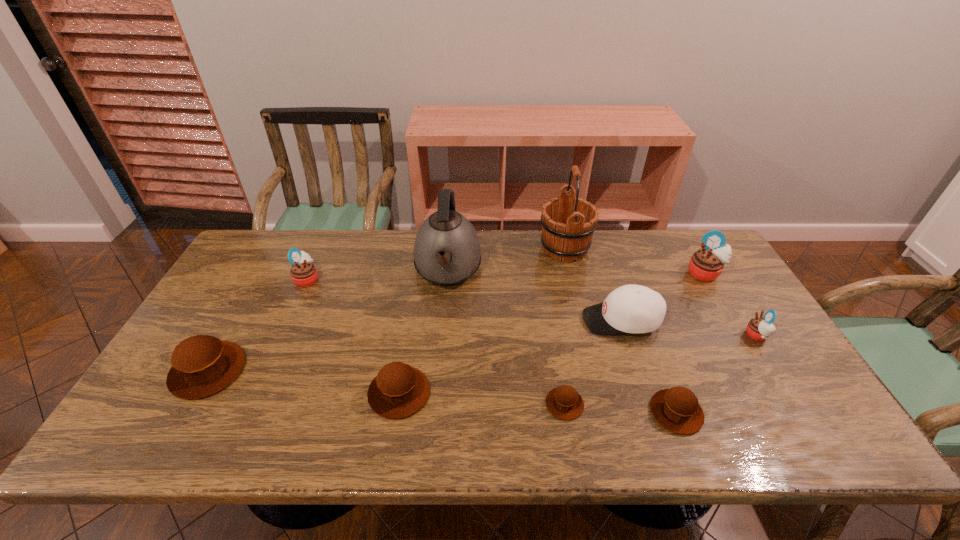
Find the location of a particular element. The image size is (960, 540). the fifth muffin from right to left is located at coordinates (398, 391).

Locate an element on the screen. the second brown muffin from left to right is located at coordinates point(398,391).

Locate an element on the screen. the fifth muffin from left to right is located at coordinates (677, 409).

Locate an element on the screen. the rightmost brown muffin is located at coordinates (677, 409).

Locate an element on the screen. This screenshot has width=960, height=540. the second brown muffin from right to left is located at coordinates (564, 402).

You are a GUI agent. You are given a task and a screenshot of the screen. Output one action in this format:
    pyautogui.click(x=<x>, y=<y>)
    Task: Click on the fourth muffin from left to right
    Image resolution: width=960 pixels, height=540 pixels.
    Given the screenshot: What is the action you would take?
    pyautogui.click(x=564, y=402)

This screenshot has width=960, height=540. I want to click on vacant space situated 0.070m on the front of the wine bucket, so click(572, 281).

Find the location of `vacant space situated 0.300m at the spout of the gray kettle`. vacant space situated 0.300m at the spout of the gray kettle is located at coordinates (438, 391).

Locate an element on the screen. Image resolution: width=960 pixels, height=540 pixels. vacant space located 0.070m on the front-facing side of the tallest muffin is located at coordinates coord(720,300).

Find the location of `vacant space located on the front-facing side of the second muffin from left to right`. vacant space located on the front-facing side of the second muffin from left to right is located at coordinates (441, 279).